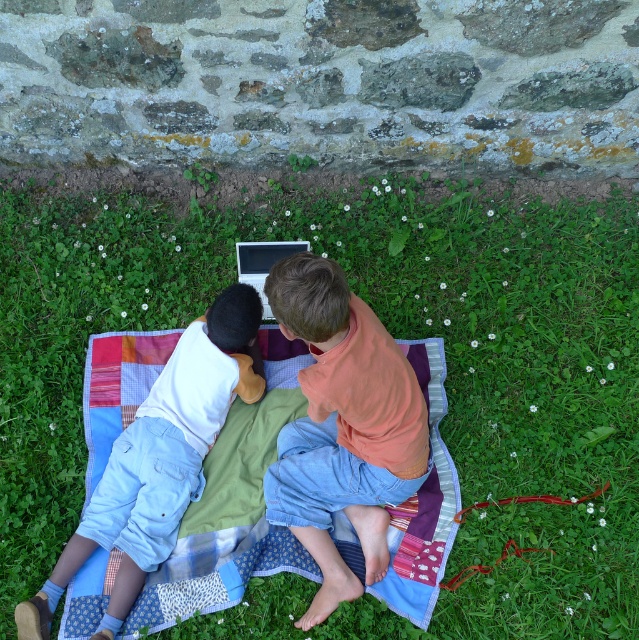
Question: Can you confirm if orange cotton shirt at center is bigger than light blue denim pants at lower left?

Choices:
 (A) yes
 (B) no

Answer: (A)

Question: Which point is closer to the camera?

Choices:
 (A) pos(238,256)
 (B) pos(325,401)
 (C) pos(119,620)
 (D) pos(201,554)

Answer: (B)

Question: Can you confirm if green grass at center is smaller than orange cotton shirt at center?

Choices:
 (A) no
 (B) yes

Answer: (A)

Question: Which point is closer to the camera taking this photo?

Choices:
 (A) (566, 484)
 (B) (252, 259)

Answer: (A)

Question: Which object is the closest to the light blue denim pants at lower left?

Choices:
 (A) orange cotton shirt at center
 (B) silver metallic laptop at center

Answer: (B)

Question: Is green grass at center wider than silver metallic laptop at center?

Choices:
 (A) yes
 (B) no

Answer: (A)